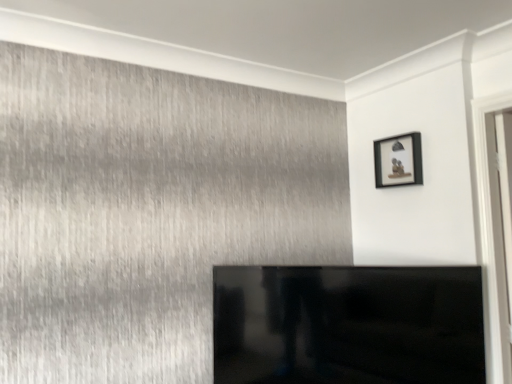
Question: Should I look upward or downward to see matte black picture frame at upper right?

Choices:
 (A) down
 (B) up

Answer: (B)

Question: Does black glossy tv at center have a smaller size compared to matte black picture frame at upper right?

Choices:
 (A) yes
 (B) no

Answer: (B)

Question: Would you say matte black picture frame at upper right is part of black glossy tv at center's contents?

Choices:
 (A) yes
 (B) no

Answer: (B)

Question: Can we say black glossy tv at center lies outside matte black picture frame at upper right?

Choices:
 (A) yes
 (B) no

Answer: (A)

Question: Is the depth of black glossy tv at center less than that of matte black picture frame at upper right?

Choices:
 (A) no
 (B) yes

Answer: (B)

Question: Considering the relative positions of black glossy tv at center and matte black picture frame at upper right in the image provided, is black glossy tv at center behind matte black picture frame at upper right?

Choices:
 (A) yes
 (B) no

Answer: (B)

Question: Is black glossy tv at center looking in the opposite direction of matte black picture frame at upper right?

Choices:
 (A) yes
 (B) no

Answer: (B)

Question: Is matte black picture frame at upper right facing towards black glossy tv at center?

Choices:
 (A) no
 (B) yes

Answer: (A)

Question: From the image's perspective, is matte black picture frame at upper right on black glossy tv at center?

Choices:
 (A) yes
 (B) no

Answer: (A)

Question: From the image's perspective, is matte black picture frame at upper right under black glossy tv at center?

Choices:
 (A) no
 (B) yes

Answer: (A)

Question: Would you say black glossy tv at center is part of matte black picture frame at upper right's contents?

Choices:
 (A) no
 (B) yes

Answer: (A)

Question: Does matte black picture frame at upper right have a lesser height compared to black glossy tv at center?

Choices:
 (A) yes
 (B) no

Answer: (A)

Question: From a real-world perspective, is matte black picture frame at upper right over black glossy tv at center?

Choices:
 (A) yes
 (B) no

Answer: (A)

Question: From the image's perspective, relative to black glossy tv at center, is matte black picture frame at upper right above or below?

Choices:
 (A) below
 (B) above

Answer: (B)